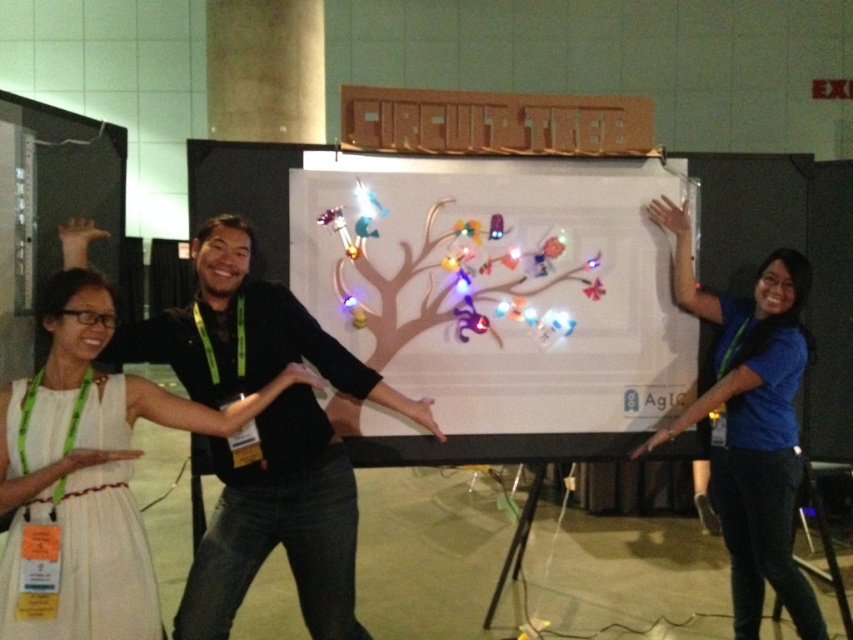
Question: Does white paper at center appear under blue shirt at upper right?

Choices:
 (A) no
 (B) yes

Answer: (A)

Question: Which of the following is the closest to the observer?

Choices:
 (A) (793, 419)
 (B) (590, 428)
 (C) (50, 353)

Answer: (C)

Question: Is white fabric dress at center positioned before blue shirt at upper right?

Choices:
 (A) yes
 (B) no

Answer: (A)

Question: Can you confirm if white fabric dress at center is positioned to the left of blue shirt at upper right?

Choices:
 (A) no
 (B) yes

Answer: (B)

Question: Which of the following is the farthest from the observer?

Choices:
 (A) white paper at center
 (B) blue shirt at upper right
 (C) white fabric dress at center

Answer: (A)

Question: Which of the following is the closest to the observer?

Choices:
 (A) blue shirt at upper right
 (B) white fabric dress at center

Answer: (B)